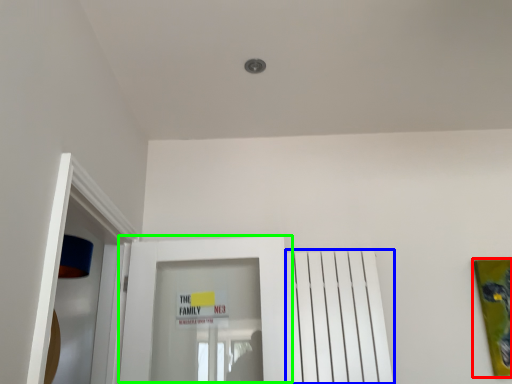
Question: Estimate the real-world distances between objects in this image. Which object is farther from picture frame (highlighted by a red box), radiator (highlighted by a blue box) or door (highlighted by a green box)?

Choices:
 (A) radiator
 (B) door

Answer: (B)